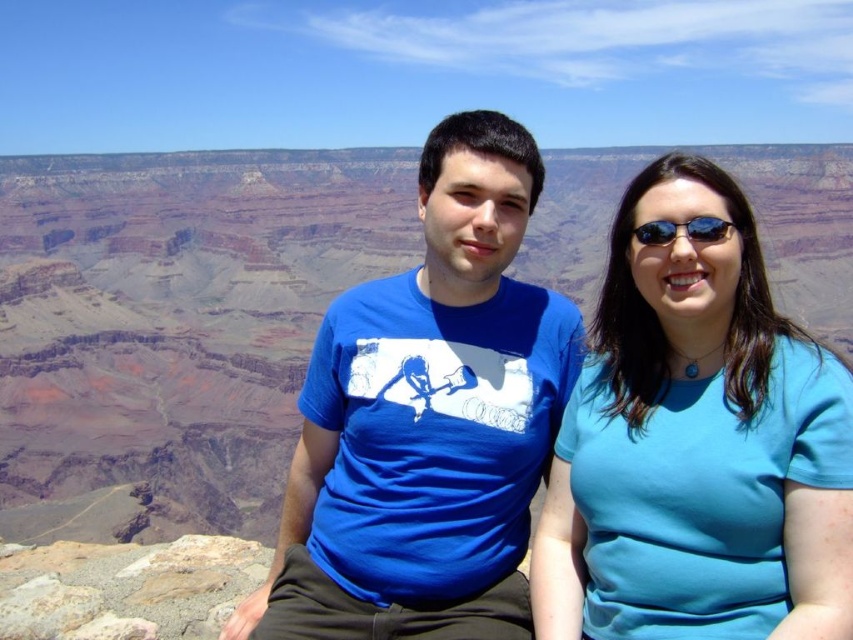
You are a photographer trying to capture a closeup of the blue fabric shirt at center and the sunglasses at upper right. Which object should you zoom in on to ensure both fit in the frame?

The blue fabric shirt at center is bigger than sunglasses at upper right, so you should zoom in on the sunglasses at upper right to ensure both fit in the frame.